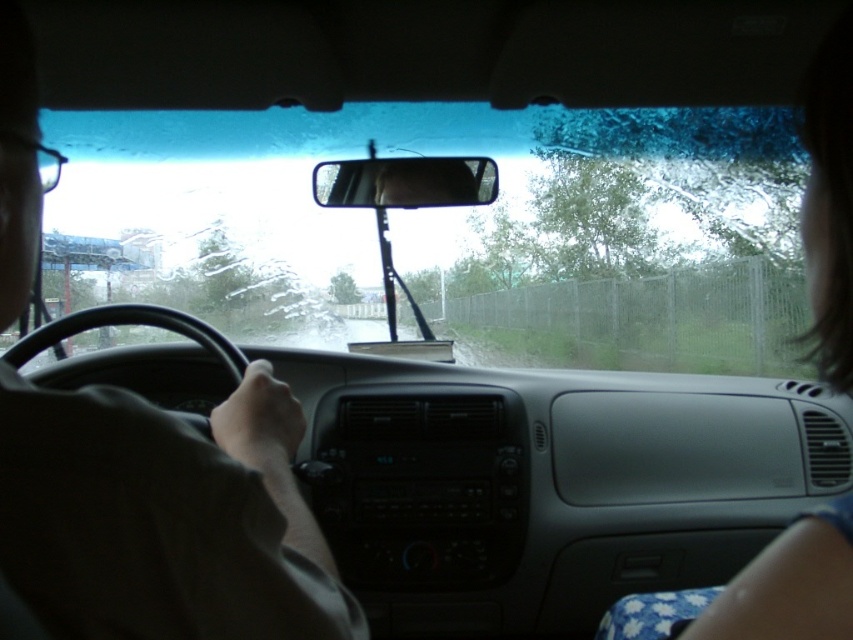
Question: Which of these objects is positioned closest to the transparent glass windshield at center?

Choices:
 (A) clear plastic view mirror at center
 (B) matte black steering wheel at left

Answer: (B)

Question: Does transparent glass windshield at center appear over clear plastic view mirror at center?

Choices:
 (A) yes
 (B) no

Answer: (A)

Question: Among these points, which one is farthest from the camera?

Choices:
 (A) (788, 150)
 (B) (161, 444)
 (C) (482, 170)

Answer: (A)

Question: Which point is closer to the camera?

Choices:
 (A) (276, 156)
 (B) (213, 472)

Answer: (B)

Question: Is transparent glass windshield at center positioned in front of matte black steering wheel at left?

Choices:
 (A) no
 (B) yes

Answer: (A)

Question: Can you confirm if transparent glass windshield at center is positioned above matte black steering wheel at left?

Choices:
 (A) no
 (B) yes

Answer: (B)